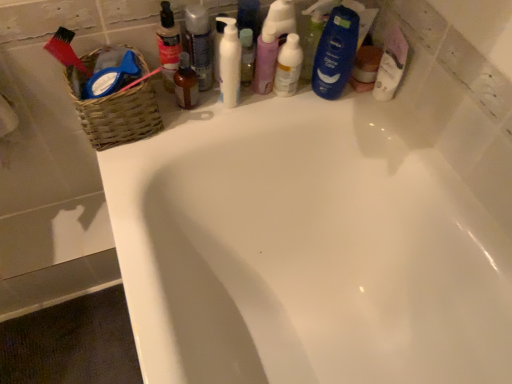
Question: Which direction should I rotate to face translucent plastic bottle at upper center, which is the 1th toiletry in left-to-right order, — up or down?

Choices:
 (A) down
 (B) up

Answer: (B)

Question: Is purple matte lotion at center, which ranks as the 2th toiletry in right-to-left order, taller than white glossy bathtub at upper center?

Choices:
 (A) yes
 (B) no

Answer: (B)

Question: From a real-world perspective, is purple matte lotion at center, which ranks as the 2th toiletry in right-to-left order, positioned over white glossy bathtub at upper center based on gravity?

Choices:
 (A) no
 (B) yes

Answer: (B)

Question: Does purple matte lotion at center, which is the 4th toiletry in left-to-right order, have a larger size compared to white glossy bathtub at upper center?

Choices:
 (A) yes
 (B) no

Answer: (B)

Question: Is white glossy bathtub at upper center at the back of purple matte lotion at center, which is the 4th toiletry in left-to-right order?

Choices:
 (A) yes
 (B) no

Answer: (B)

Question: Is purple matte lotion at center, which is the 4th toiletry in left-to-right order, not near white glossy bathtub at upper center?

Choices:
 (A) no
 (B) yes

Answer: (A)

Question: Considering the relative sizes of purple matte lotion at center, which is the 4th toiletry in left-to-right order, and white glossy bathtub at upper center in the image provided, is purple matte lotion at center, which is the 4th toiletry in left-to-right order, thinner than white glossy bathtub at upper center?

Choices:
 (A) yes
 (B) no

Answer: (A)

Question: Does woven brown basket at upper left appear on the left side of translucent plastic bottle at upper center, positioned as the 3th toiletry in right-to-left order?

Choices:
 (A) no
 (B) yes

Answer: (B)

Question: Are woven brown basket at upper left and translucent plastic bottle at upper center, positioned as the 3th toiletry in left-to-right order, making contact?

Choices:
 (A) yes
 (B) no

Answer: (B)

Question: Is woven brown basket at upper left thinner than translucent plastic bottle at upper center, positioned as the 3th toiletry in right-to-left order?

Choices:
 (A) yes
 (B) no

Answer: (B)

Question: Is woven brown basket at upper left wider than translucent plastic bottle at upper center, positioned as the 3th toiletry in right-to-left order?

Choices:
 (A) yes
 (B) no

Answer: (A)

Question: Is the position of woven brown basket at upper left less distant than that of translucent plastic bottle at upper center, positioned as the 3th toiletry in right-to-left order?

Choices:
 (A) no
 (B) yes

Answer: (B)

Question: Does woven brown basket at upper left have a smaller size compared to translucent plastic bottle at upper center, positioned as the 3th toiletry in left-to-right order?

Choices:
 (A) no
 (B) yes

Answer: (A)

Question: Is white matte pump bottle at upper center completely or partially inside translucent plastic bottle at upper center, the 5th toiletry in the right-to-left sequence?

Choices:
 (A) no
 (B) yes

Answer: (A)